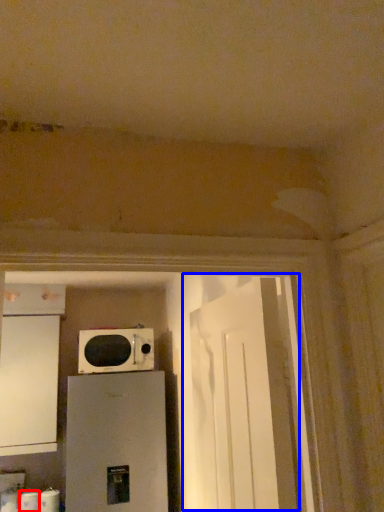
Question: Which object is closer to the camera taking this photo, toilet paper (highlighted by a red box) or door (highlighted by a blue box)?

Choices:
 (A) toilet paper
 (B) door

Answer: (B)